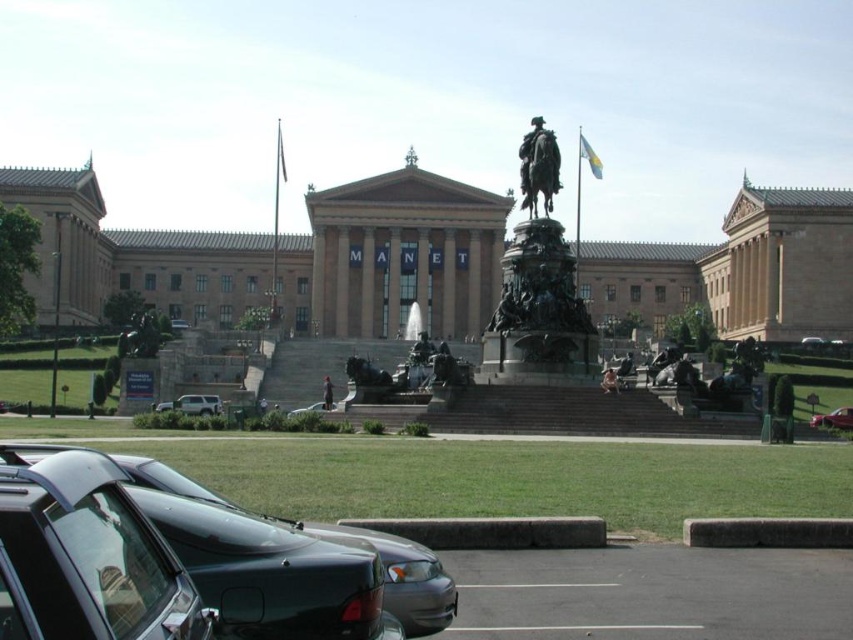
You are a visitor who just arrived at the MANET museum and see the satin silver suv at lower left and the dark gray fabric jacket at center. Which object is positioned more to the left side of the scene?

The satin silver suv at lower left is positioned more to the left side of the scene than the dark gray fabric jacket at center.

You are standing in front of the MANET museum and want to take a photo of the entrance. There are two points marked on the ground where you can stand. The first point is at coordinate point (178, 401) and the second is at point (323, 385). Which point should you choose to be closer to the entrance for a better closeup shot?

You should choose point (178, 401) because it is closer to the camera, allowing for a closer proximity to the entrance and a better closeup shot.